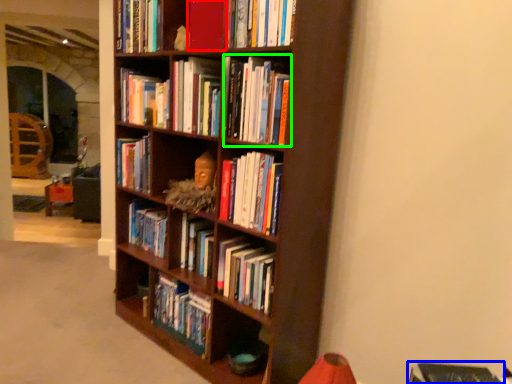
Question: Estimate the real-world distances between objects in this image. Which object is closer to book (highlighted by a red box), book (highlighted by a blue box) or book (highlighted by a green box)?

Choices:
 (A) book
 (B) book

Answer: (B)